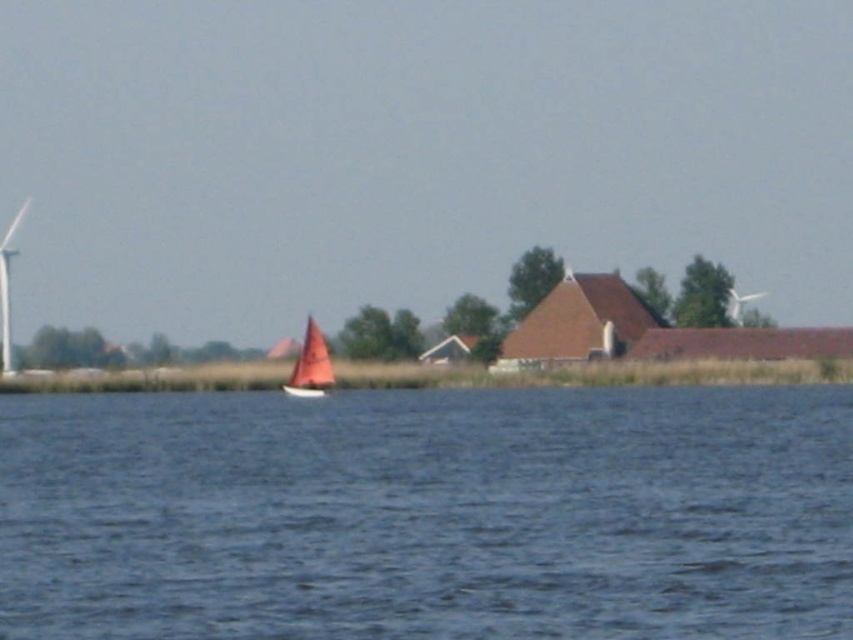
Which is more to the left, blue water at center or red sailboat at center?

red sailboat at center

Who is more distant from viewer, (769, 637) or (300, 388)?

The point (300, 388) is behind.

Locate an element on the screen. The height and width of the screenshot is (640, 853). blue water at center is located at coordinates (428, 515).

Measure the distance between blue water at center and camera.

The distance of blue water at center from camera is 16.88 meters.

Can you confirm if blue water at center is positioned to the right of white plastic wind turbine at left?

Indeed, blue water at center is positioned on the right side of white plastic wind turbine at left.

You are a GUI agent. You are given a task and a screenshot of the screen. Output one action in this format:
    pyautogui.click(x=<x>, y=<y>)
    Task: Click on the blue water at center
    Image resolution: width=853 pixels, height=640 pixels.
    Given the screenshot: What is the action you would take?
    pyautogui.click(x=428, y=515)

The height and width of the screenshot is (640, 853). Describe the element at coordinates (310, 365) in the screenshot. I see `red sailboat at center` at that location.

Is red sailboat at center taller than white plastic wind turbine at left?

No, red sailboat at center is not taller than white plastic wind turbine at left.

Which is behind, point (302, 349) or point (27, 205)?

Positioned behind is point (27, 205).

This screenshot has width=853, height=640. In order to click on red sailboat at center in this screenshot , I will do `click(310, 365)`.